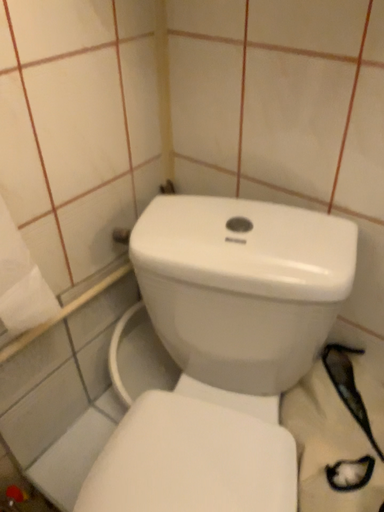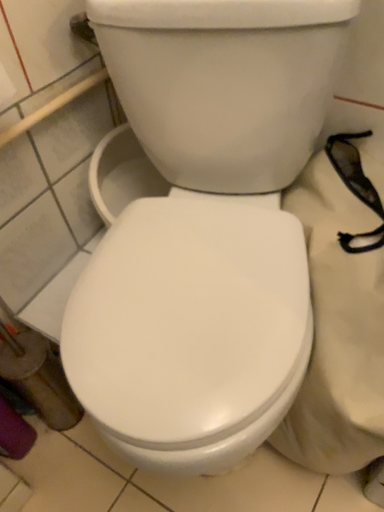
Question: Which way did the camera rotate in the video?

Choices:
 (A) rotated upward
 (B) rotated downward

Answer: (B)